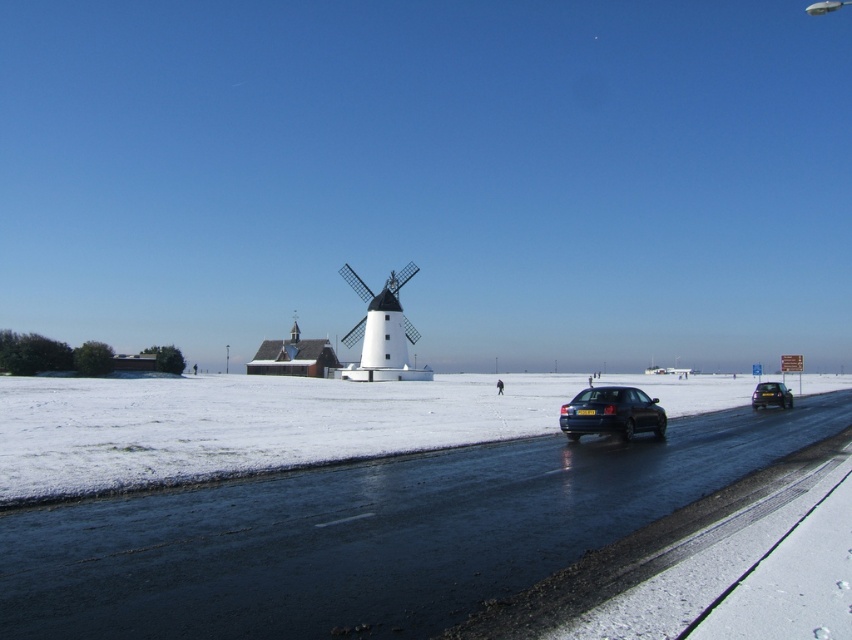
You are standing at point (773, 387) and want to walk to point (430, 400). Based on the scene description, will you be moving towards the foreground or the background?

You will be moving towards the background because point (430, 400) is behind point (773, 387).

You are standing at the point closer to the camera between point (160, 396) and point (609, 390). Which point are you at?

You are at point (160, 396) because it is further to the camera than point (609, 390).